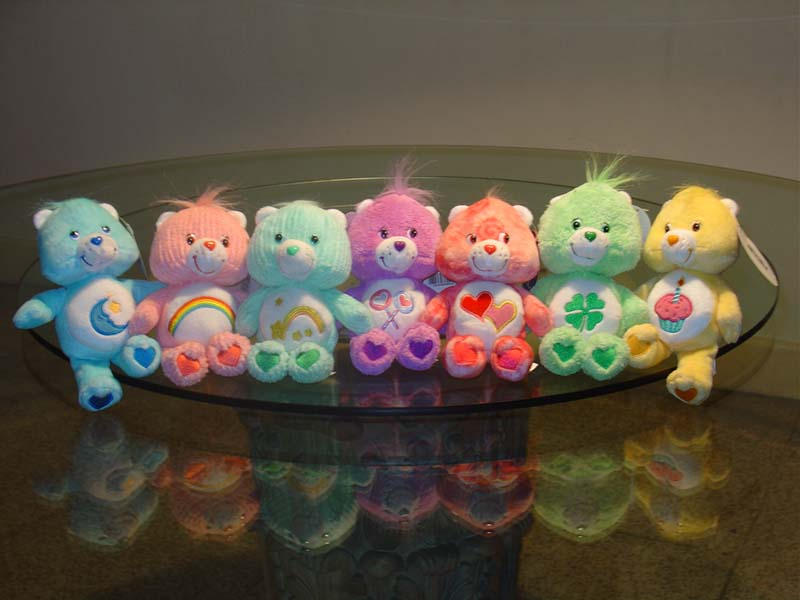
Find the location of `blue stuffed bear`. blue stuffed bear is located at coordinates coord(86,214).